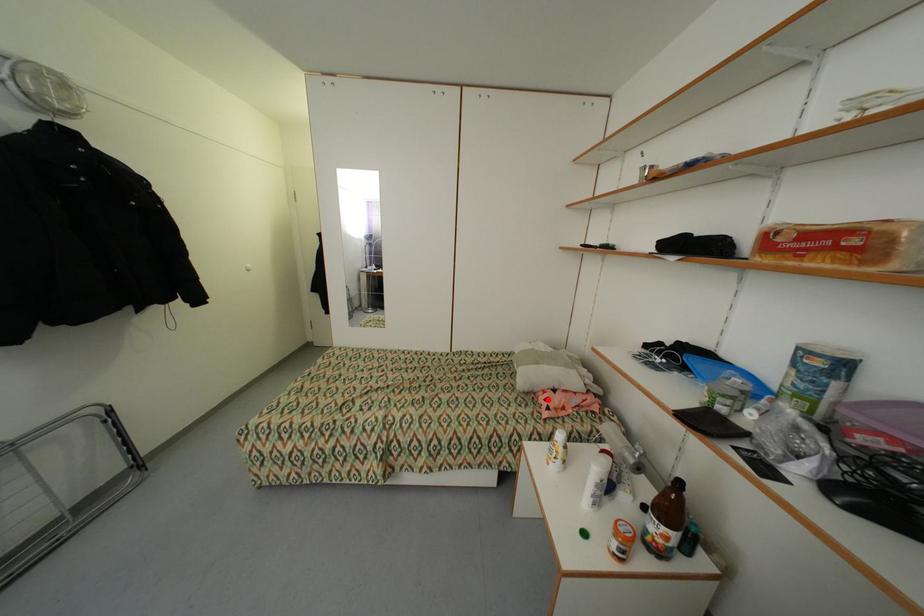
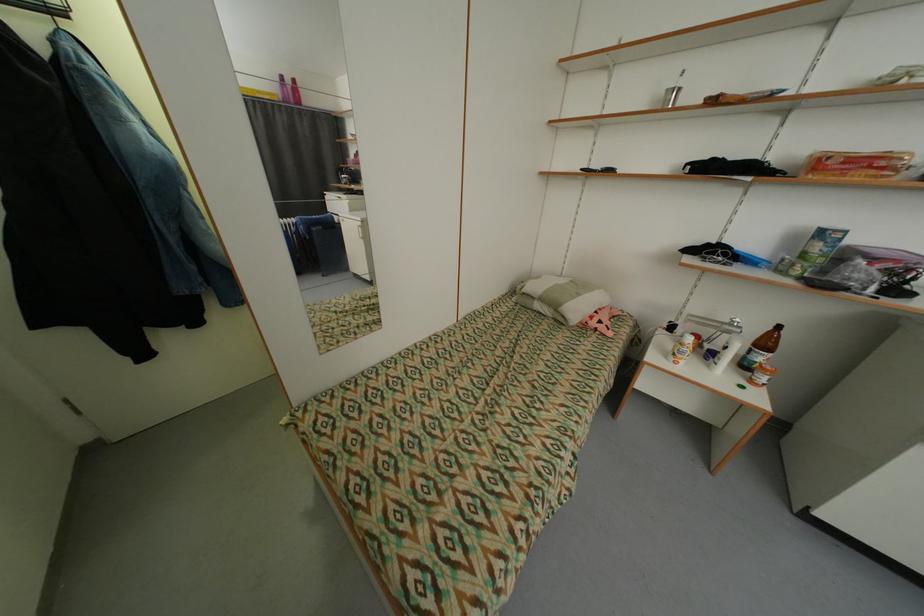
Question: I am providing you with two images of the same scene from different viewpoints. In image1, a red point is highlighted. Considering the same 3D point in image2, which of the following is correct?

Choices:
 (A) It is closer
 (B) It is farther

Answer: (A)